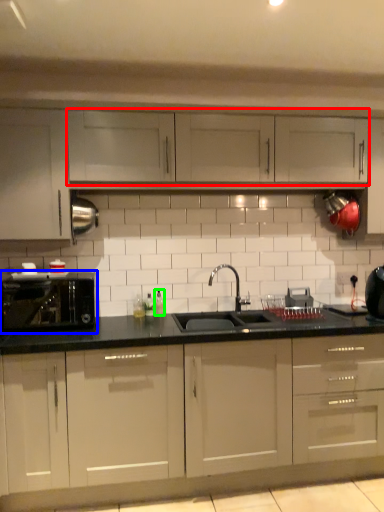
Question: Which object is positioned closest to cabinetry (highlighted by a red box)? Select from home appliance (highlighted by a blue box) and bottle (highlighted by a green box).

Choices:
 (A) home appliance
 (B) bottle

Answer: (B)